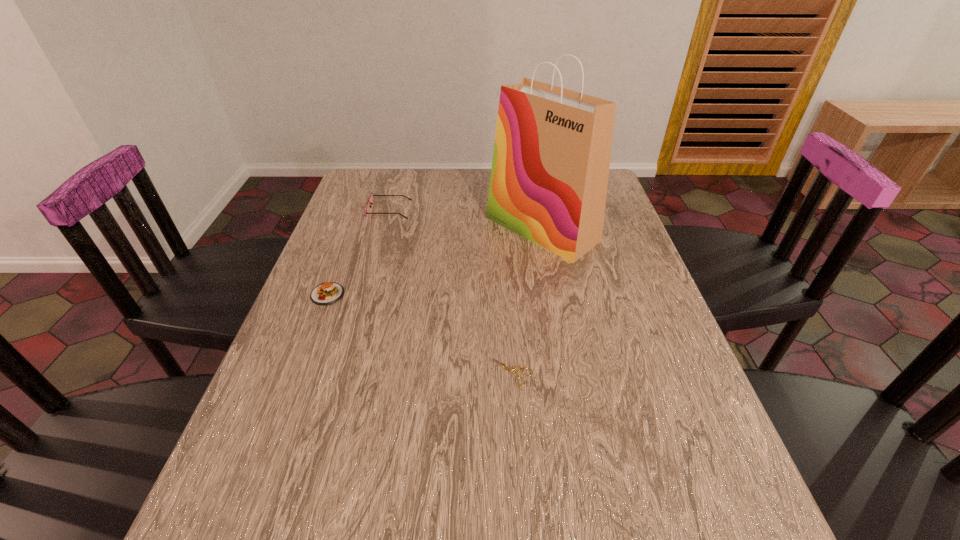
Where is `free space at the near left corner of the desktop`? Image resolution: width=960 pixels, height=540 pixels. free space at the near left corner of the desktop is located at coordinates (235, 523).

Locate an element on the screen. The height and width of the screenshot is (540, 960). free point between the shopping bag and the shortest object is located at coordinates (527, 300).

The width and height of the screenshot is (960, 540). I want to click on free spot between the tallest object and the nearest object, so click(527, 300).

Identify the location of free spot between the third tallest object and the shopping bag. (435, 261).

Find the location of a particular element. This screenshot has height=540, width=960. empty location between the nearest object and the third tallest object is located at coordinates (420, 333).

Where is `empty space that is in between the tallest object and the sunglasses`? empty space that is in between the tallest object and the sunglasses is located at coordinates (466, 219).

The width and height of the screenshot is (960, 540). I want to click on vacant area that lies between the third farthest object and the second tallest object, so pyautogui.click(x=358, y=252).

Where is `vacant space in between the sunglasses and the shopping bag`? This screenshot has width=960, height=540. vacant space in between the sunglasses and the shopping bag is located at coordinates (466, 219).

Find the location of a particular element. The width and height of the screenshot is (960, 540). vacant area between the shears and the second nearest object is located at coordinates (420, 333).

This screenshot has width=960, height=540. Find the location of `blank region between the shortest object and the second shortest object`. blank region between the shortest object and the second shortest object is located at coordinates (420, 333).